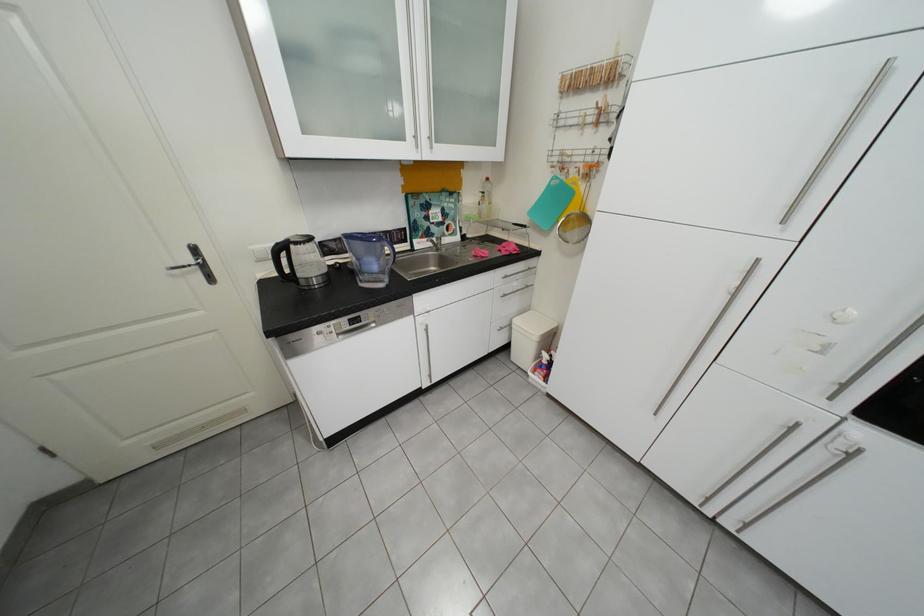
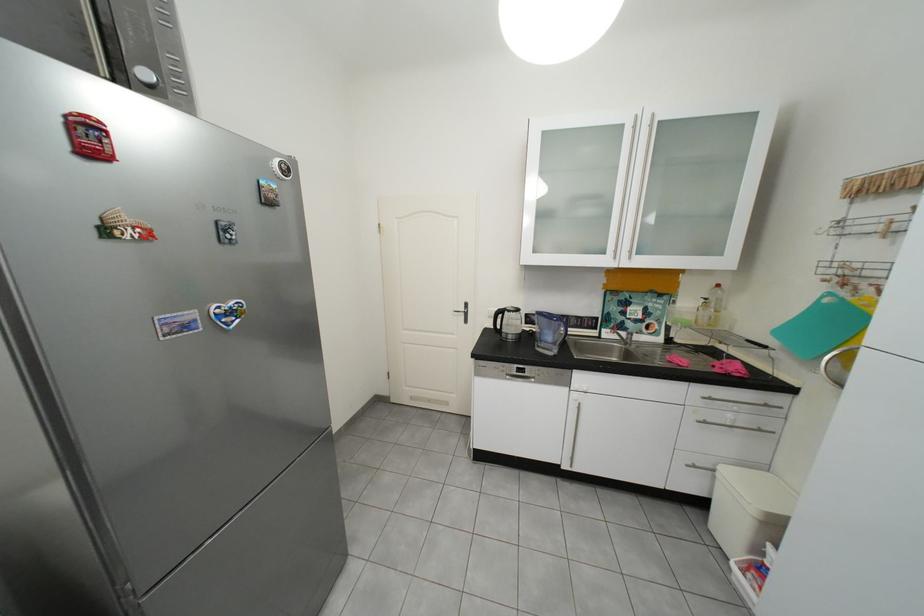
Where in the second image is the point corresponding to the point at 432,245 from the first image?

(619, 334)